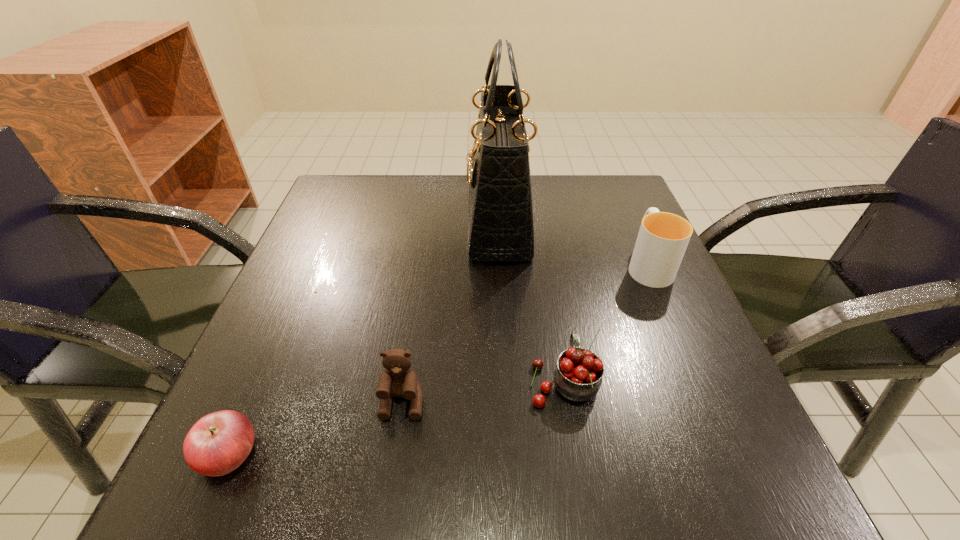
Image resolution: width=960 pixels, height=540 pixels. Find the location of `object that is positioned at the right edge`. object that is positioned at the right edge is located at coordinates (663, 237).

The width and height of the screenshot is (960, 540). I want to click on object present at the near left corner, so click(x=218, y=443).

Where is `free region at the far edge of the desktop`? free region at the far edge of the desktop is located at coordinates (556, 221).

At what (x,y) coordinates should I click in order to perform the action: click on vacant space at the near edge. Please return your answer as a coordinate pair (x, y). Looking at the image, I should click on (474, 463).

Where is `free location at the left edge`? Image resolution: width=960 pixels, height=540 pixels. free location at the left edge is located at coordinates click(301, 264).

The image size is (960, 540). In order to click on vacant space at the right edge in this screenshot , I will do `click(680, 401)`.

This screenshot has height=540, width=960. I want to click on vacant space at the far left corner of the desktop, so click(x=318, y=227).

This screenshot has height=540, width=960. In the image, there is a desktop. Identify the location of vacant space at the far right corner. (636, 218).

You are a GUI agent. You are given a task and a screenshot of the screen. Output one action in this format:
    pyautogui.click(x=<x>, y=<y>)
    Task: Click on the unoccupied area between the rightmost object and the tallest object
    
    Given the screenshot: What is the action you would take?
    pyautogui.click(x=573, y=244)

This screenshot has width=960, height=540. Identify the location of free space that is in between the apple and the second object from left to right. (316, 428).